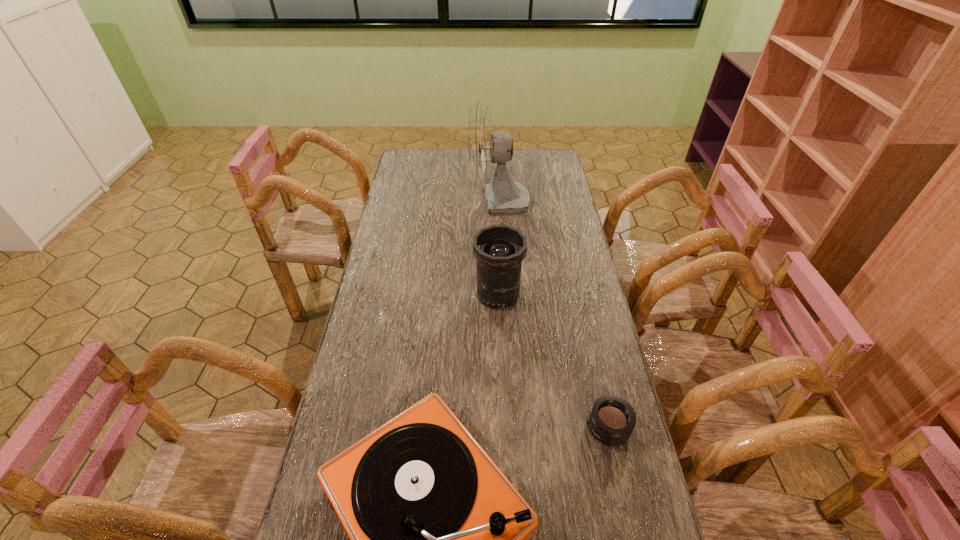
This screenshot has height=540, width=960. Identify the location of the tallest object. (485, 147).

Locate an element on the screen. Image resolution: width=960 pixels, height=540 pixels. fan is located at coordinates (485, 147).

Where is `the second farthest object`? The height and width of the screenshot is (540, 960). the second farthest object is located at coordinates (499, 249).

Where is `the left telephoto lens`? Image resolution: width=960 pixels, height=540 pixels. the left telephoto lens is located at coordinates pos(499,249).

The height and width of the screenshot is (540, 960). What are the coordinates of `the nearer telephoto lens` in the screenshot? It's located at (611, 421).

This screenshot has height=540, width=960. I want to click on the rightmost object, so click(x=611, y=421).

The height and width of the screenshot is (540, 960). Identify the location of free space located 0.190m in front of the fan to blow air. (424, 201).

Identify the location of blank area located in front of the fan to blow air. The width and height of the screenshot is (960, 540). (449, 201).

Where is `vacant space located 0.080m in front of the fan to blow air`? This screenshot has width=960, height=540. vacant space located 0.080m in front of the fan to blow air is located at coordinates (449, 201).

Find the location of `vacant space located 0.080m on the left of the third shortest object`. vacant space located 0.080m on the left of the third shortest object is located at coordinates (450, 295).